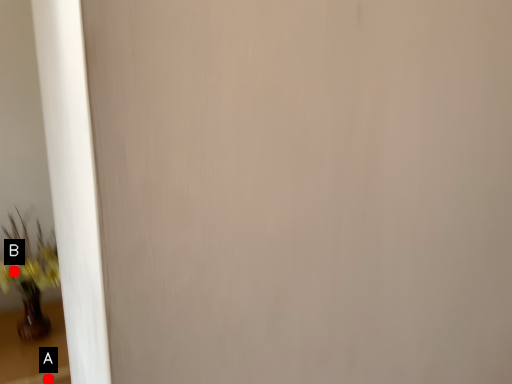
Question: Two points are circled on the image, labeled by A and B beside each circle. Among these points, which one is farthest from the camera?

Choices:
 (A) A is further
 (B) B is further

Answer: (B)